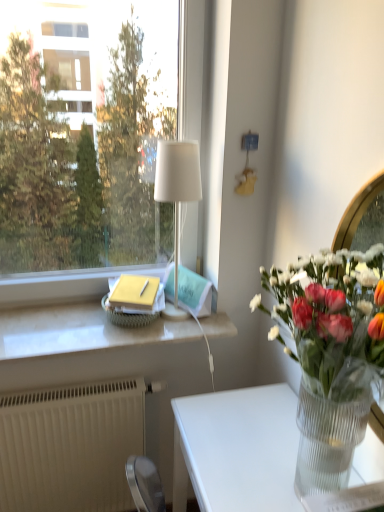
Locate an element on the screen. free space on the front side of white fabric lampshade at upper center is located at coordinates (170, 333).